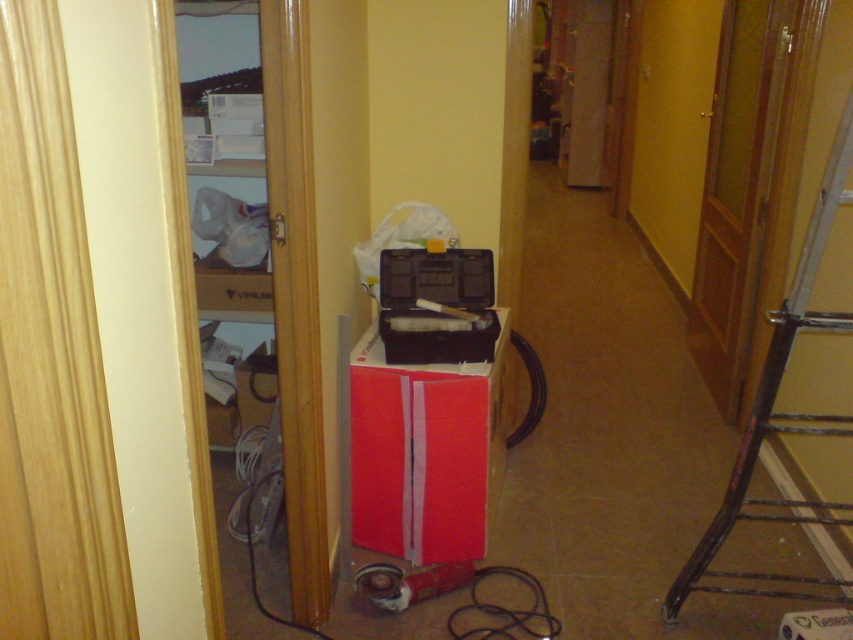
You are standing at the entrance of the hallway and see two points marked in the scene. One is at coordinates point (444, 528) and the other at point (849, 160). Which point is closer to you?

Point (849, 160) is closer to you because it is in front of point (444, 528) according to their spatial relationship.

You are moving boxes into the storage room and see the red cardboard box at center and the metallic black ladder at right. Which object is closer to the floor?

The red cardboard box at center is closer to the floor since it is positioned below the metallic black ladder at right.